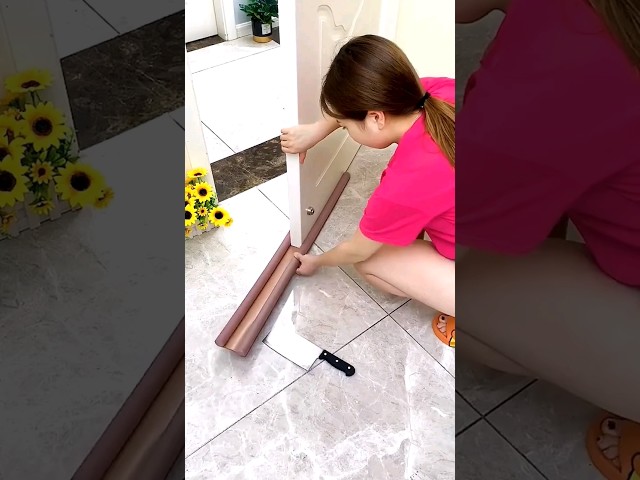
Locate an element on the screen. This screenshot has width=640, height=480. green plant is located at coordinates (260, 12).